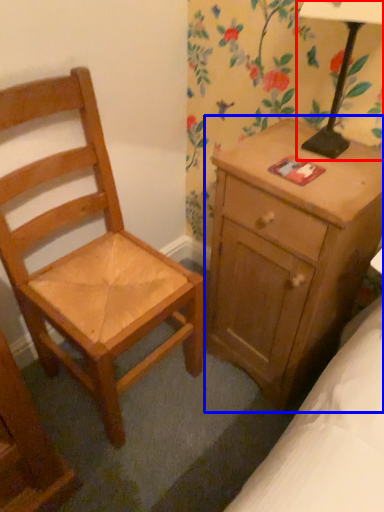
Question: Which object is further to the camera taking this photo, table lamp (highlighted by a red box) or nightstand (highlighted by a blue box)?

Choices:
 (A) table lamp
 (B) nightstand

Answer: (B)